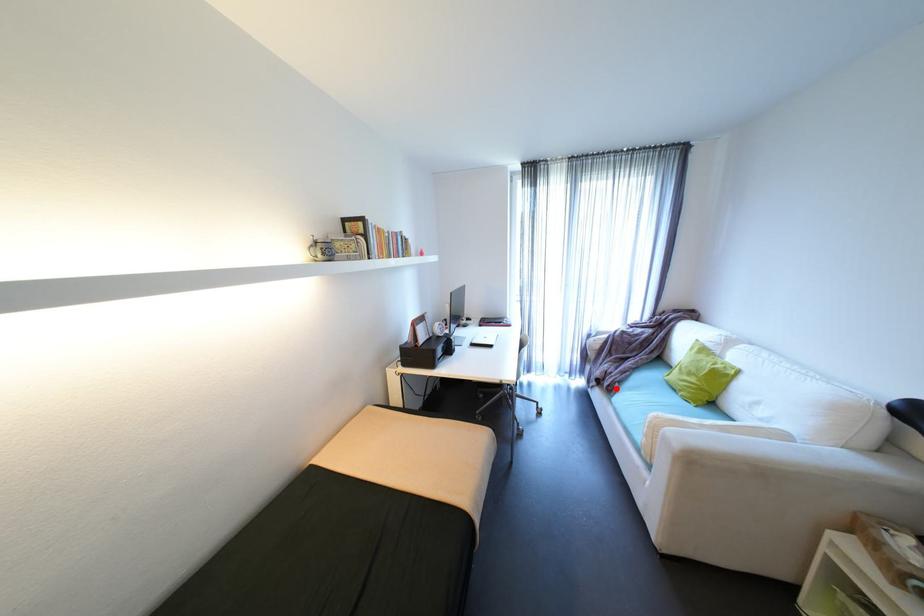
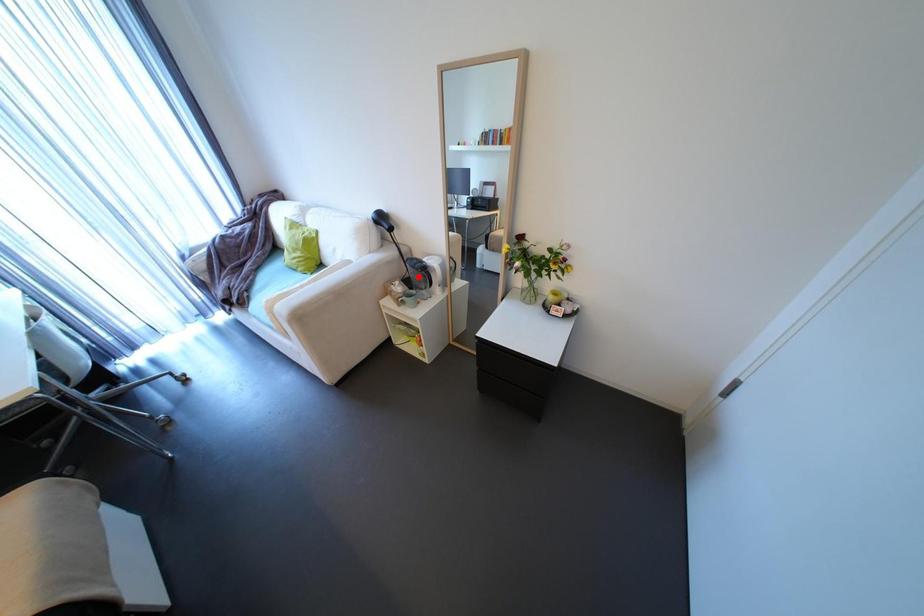
I am providing you with two images of the same scene from different viewpoints. A red point is marked on the first image and another point is marked on the second image. Does the point marked in image1 correspond to the same location as the one in image2?

No